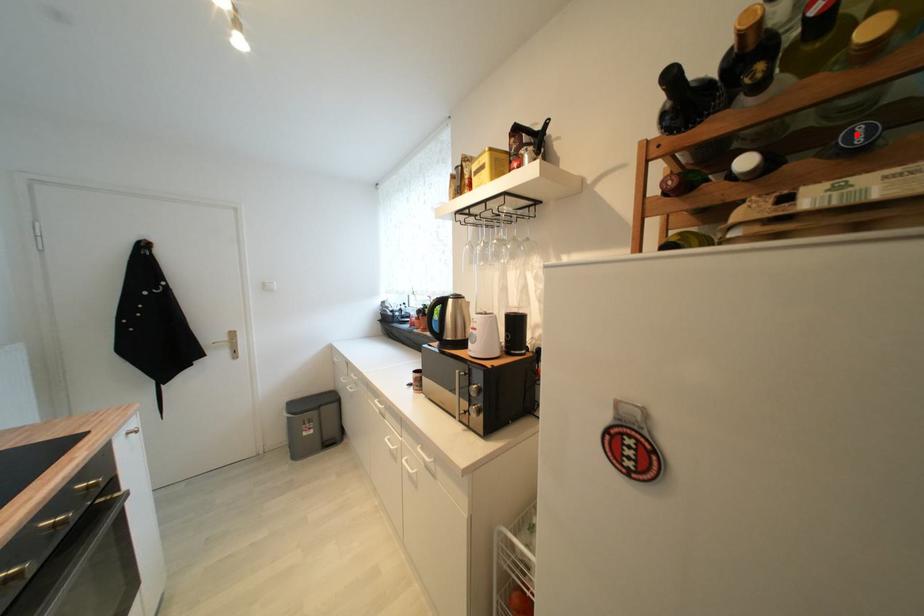
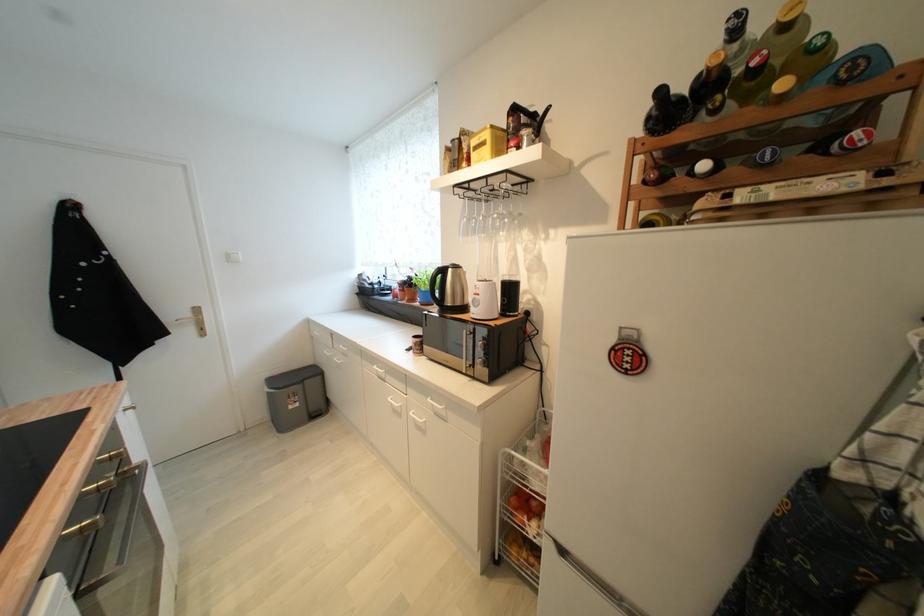
The point at the highlighted location is marked in the first image. Where is the corresponding point in the second image?

(769, 155)